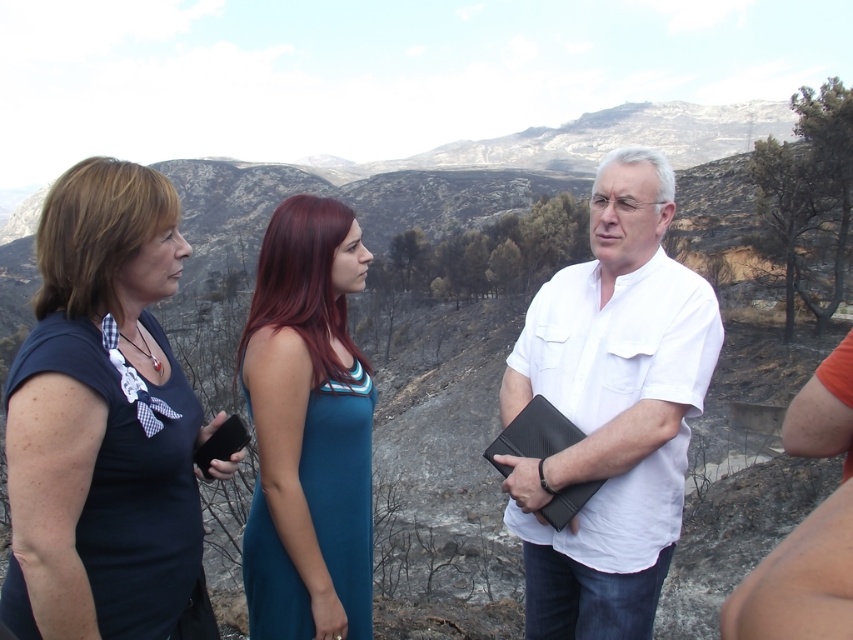
Question: Among these points, which one is nearest to the camera?

Choices:
 (A) (350, 582)
 (B) (642, 582)

Answer: (A)

Question: Which object is farther from the camera taking this photo?

Choices:
 (A) white matte shirt at center
 (B) matte black shirt at center
 (C) teal satin dress at center

Answer: (C)

Question: Is white matte shirt at center wider than teal satin dress at center?

Choices:
 (A) no
 (B) yes

Answer: (B)

Question: Is the position of matte black shirt at center less distant than that of teal satin dress at center?

Choices:
 (A) yes
 (B) no

Answer: (A)

Question: Which point is farther from the camera taking this photo?

Choices:
 (A) (148, 404)
 (B) (289, 221)
 (C) (648, 461)

Answer: (B)

Question: Can you confirm if white matte shirt at center is bigger than teal satin dress at center?

Choices:
 (A) no
 (B) yes

Answer: (B)